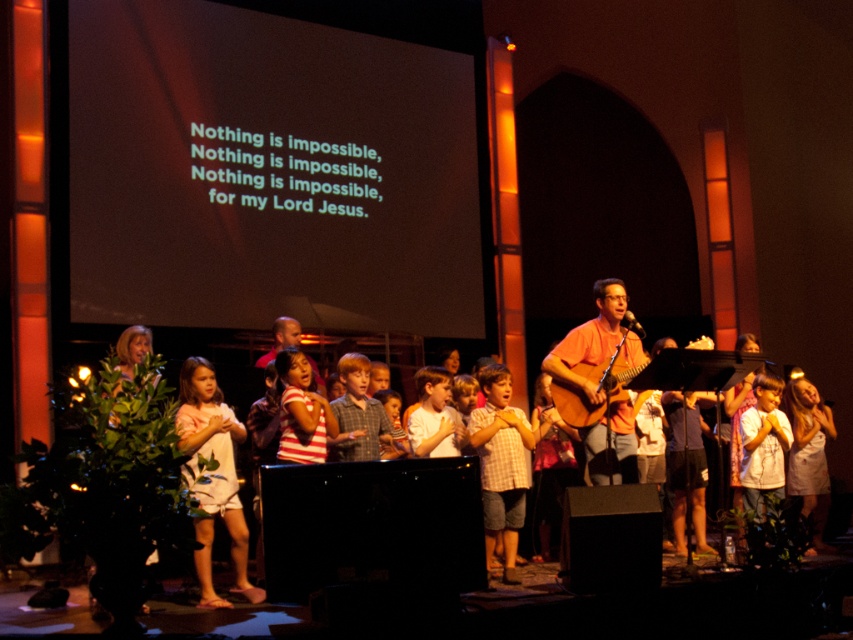
Between orange matte guitar at center and smooth brown shirt at center, which one appears on the right side from the viewer's perspective?

orange matte guitar at center

Is orange matte guitar at center in front of smooth brown shirt at center?

Yes.

The image size is (853, 640). I want to click on orange matte guitar at center, so click(590, 339).

Is pink cotton dress at center above checkered fabric shirt at center?

Yes, pink cotton dress at center is above checkered fabric shirt at center.

Which is above, pink cotton dress at center or checkered fabric shirt at center?

pink cotton dress at center is higher up.

Which is behind, point (235, 436) or point (523, 474)?

Point (523, 474)

Where is `pink cotton dress at center`? The height and width of the screenshot is (640, 853). pink cotton dress at center is located at coordinates (213, 458).

Is pink cotton dress at center positioned in front of smooth brown shirt at center?

Yes, it is.

You are a GUI agent. You are given a task and a screenshot of the screen. Output one action in this format:
    pyautogui.click(x=<x>, y=<y>)
    Task: Click on the pink cotton dress at center
    The width and height of the screenshot is (853, 640).
    Given the screenshot: What is the action you would take?
    pyautogui.click(x=213, y=458)